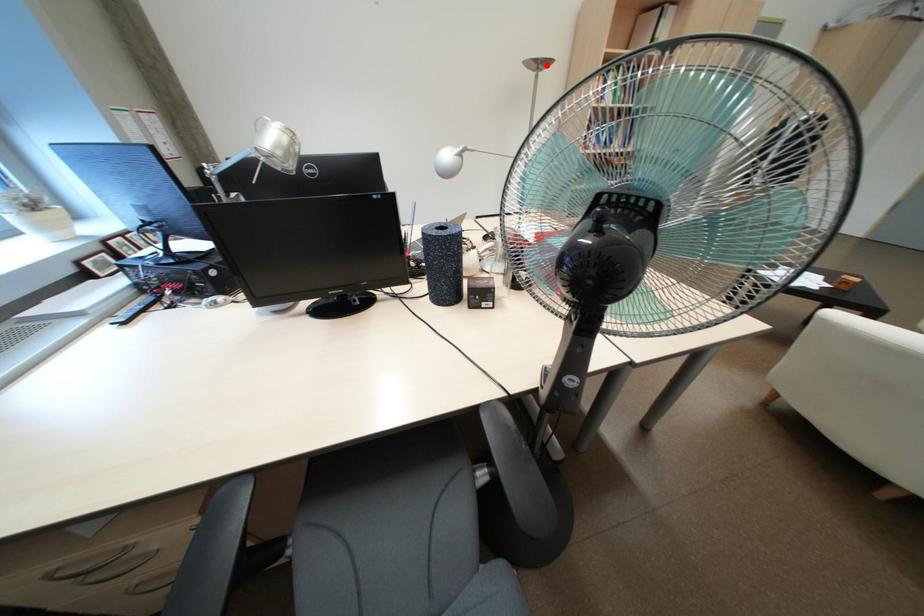
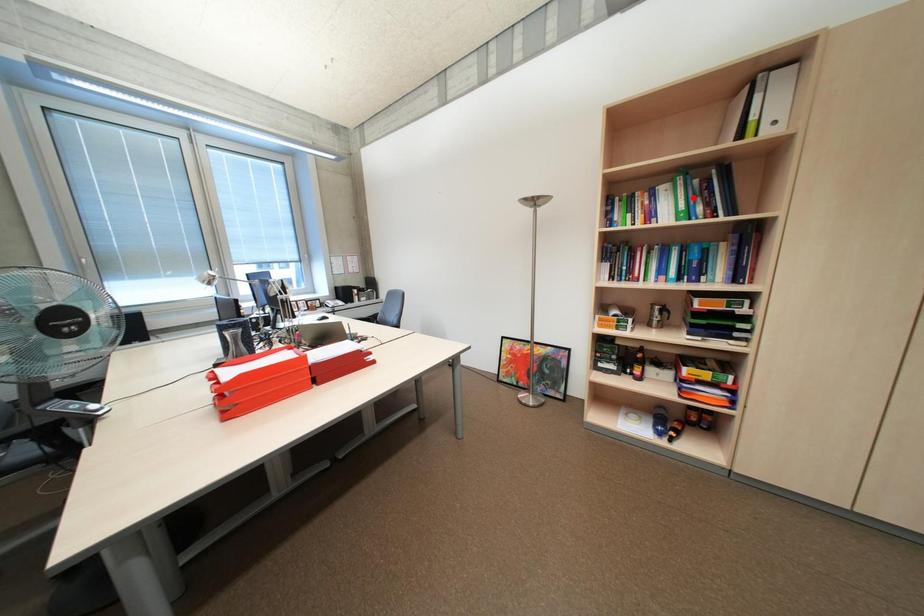
I am providing you with two images of the same scene from different viewpoints. A red point is marked on the first image and another point is marked on the second image. Do the highlighted points in image1 and image2 indicate the same real-world spot?

No